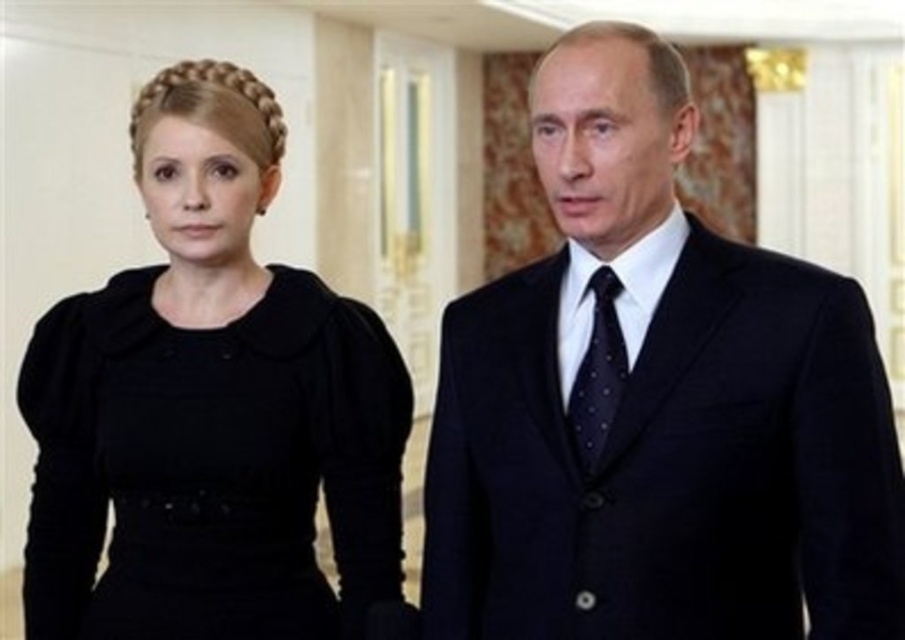
You are a photographer setting up for a group photo. You need to ensure that all subjects are visible. Considering the black velvet dress at left and the dark blue dotted tie at center, which one might require more space in the frame to be fully captured?

The black velvet dress at left is bigger than the dark blue dotted tie at center, so it would require more space in the frame to be fully captured.

You are a photographer setting up for a group photo. You need to position the black velvet dress at left and the dark blue dotted tie at center so that the dress is to the right of the tie. Is the current arrangement correct?

The black velvet dress at left is currently to the left of the dark blue dotted tie at center. To have the dress to the right of the tie, the individuals would need to swap positions.

You are a photographer setting up for a group photo. You need to ensure that the matte black suit at center and the dark blue dotted tie at center are both clearly visible in the frame. Given their sizes, which one might require more careful positioning to avoid being obscured?

The matte black suit at center is larger in size than the dark blue dotted tie at center, so the dark blue dotted tie at center might require more careful positioning to avoid being obscured by the larger suit.